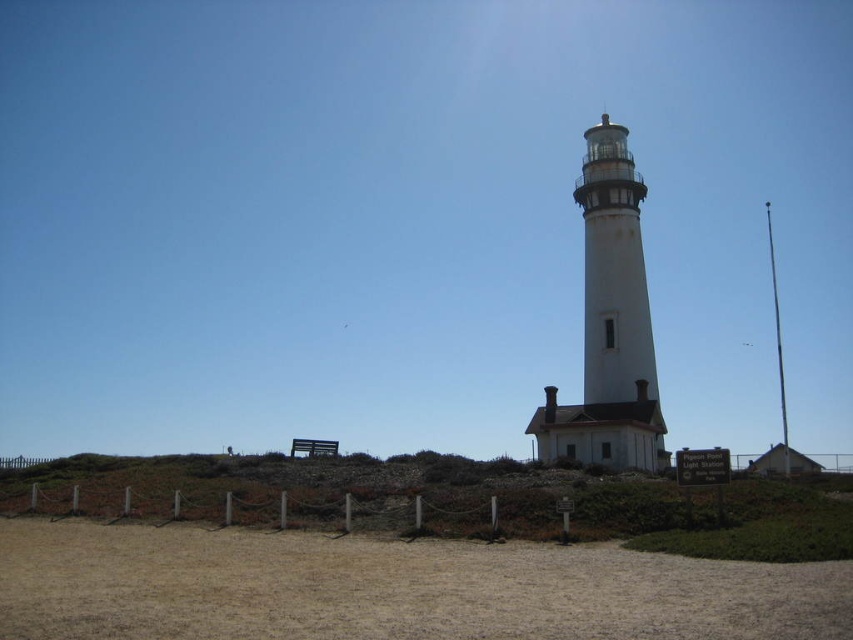
Question: Does brown sandy ground at lower center have a greater width compared to white stone lighthouse at center?

Choices:
 (A) yes
 (B) no

Answer: (A)

Question: Is brown sandy ground at lower center to the left of white stone lighthouse at center from the viewer's perspective?

Choices:
 (A) no
 (B) yes

Answer: (B)

Question: Considering the relative positions of brown sandy ground at lower center and white stone lighthouse at center in the image provided, where is brown sandy ground at lower center located with respect to white stone lighthouse at center?

Choices:
 (A) below
 (B) above

Answer: (A)

Question: Which object is farther from the camera taking this photo?

Choices:
 (A) brown sandy ground at lower center
 (B) white stone lighthouse at center

Answer: (B)